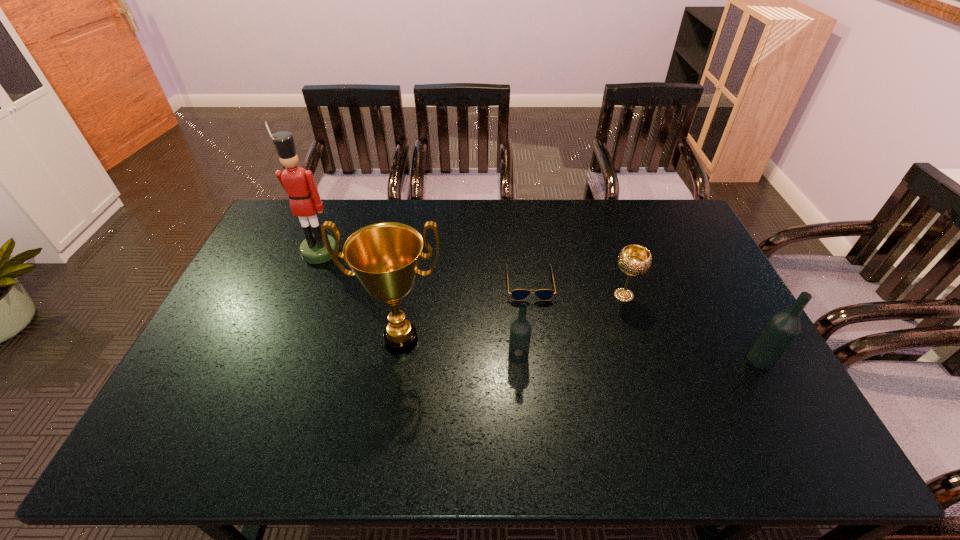
Locate an element on the screen. The height and width of the screenshot is (540, 960). the left vodka is located at coordinates (520, 331).

This screenshot has width=960, height=540. I want to click on the fourth shortest object, so pos(782,329).

This screenshot has width=960, height=540. What are the coordinates of `the taller vodka` in the screenshot? It's located at (782, 329).

At what (x,y) coordinates should I click in order to perform the action: click on nutcracker. Please return your answer as a coordinate pair (x, y). Looking at the image, I should click on (299, 184).

You are a GUI agent. You are given a task and a screenshot of the screen. Output one action in this format:
    pyautogui.click(x=<x>, y=<y>)
    Task: Click on the farthest object
    
    Given the screenshot: What is the action you would take?
    pyautogui.click(x=299, y=184)

Identify the location of the shortest object. Image resolution: width=960 pixels, height=540 pixels. (518, 294).

The image size is (960, 540). Identify the location of chalice. (634, 260).

I want to click on award, so click(385, 256).

Locate an element on the screen. This screenshot has width=960, height=540. vacant point located on the left of the shorter vodka is located at coordinates (409, 356).

I want to click on blank space located 0.090m on the front of the right vodka, so click(783, 401).